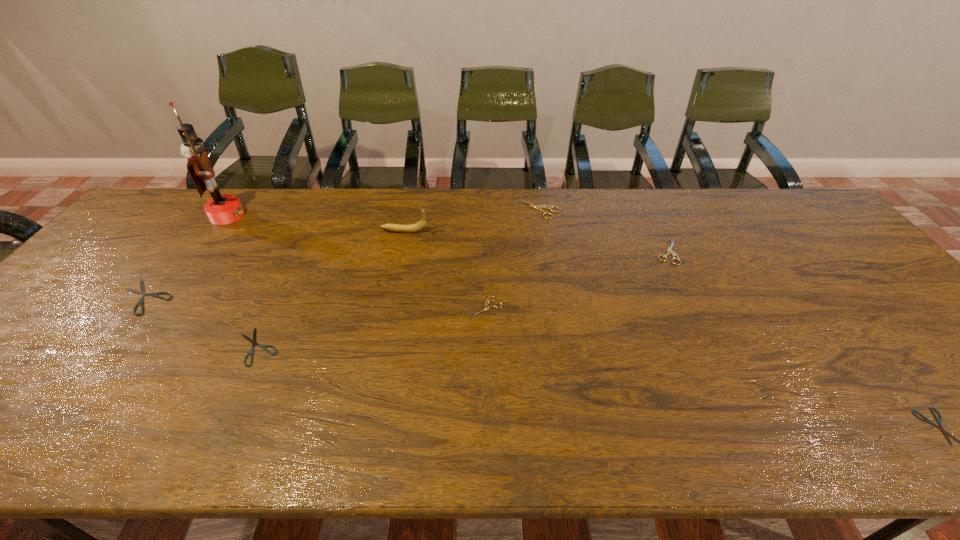
Locate an element on the screen. The height and width of the screenshot is (540, 960). vacant point located between the red nutcracker and the leftmost black shears is located at coordinates (186, 256).

Where is `empty location between the fourth tallest object and the red nutcracker`? This screenshot has width=960, height=540. empty location between the fourth tallest object and the red nutcracker is located at coordinates (447, 234).

The image size is (960, 540). I want to click on vacant space that is in between the second beige shears from left to right and the biggest black shears, so click(342, 253).

Find the location of a particular element. This screenshot has width=960, height=540. vacant area that lies between the farthest black shears and the red nutcracker is located at coordinates (186, 256).

Identify the location of vacant space in between the farthest black shears and the fourth shears from right to left. Image resolution: width=960 pixels, height=540 pixels. (316, 302).

Find the location of `free space that is in between the nutcracker and the fifth shears from right to left`. free space that is in between the nutcracker and the fifth shears from right to left is located at coordinates (242, 281).

Where is `empty location between the second farthest shears and the biggest black shears`? Image resolution: width=960 pixels, height=540 pixels. empty location between the second farthest shears and the biggest black shears is located at coordinates (406, 275).

Image resolution: width=960 pixels, height=540 pixels. I want to click on free spot between the red nutcracker and the fourth object from right to left, so click(357, 261).

The height and width of the screenshot is (540, 960). What are the coordinates of `the sixth closest object to the shortest object` in the screenshot? It's located at (141, 292).

What are the coordinates of `object that stands as the second closest to the red nutcracker` in the screenshot? It's located at (420, 225).